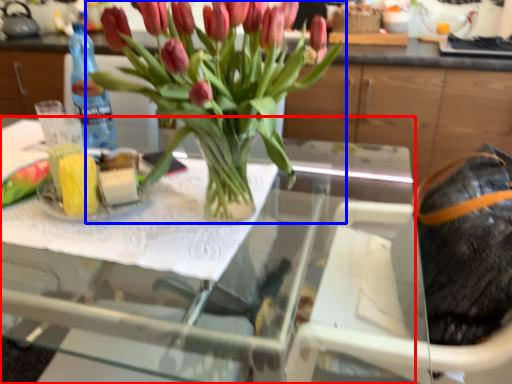
Question: Which point is closer to the camera, table (highlighted by a red box) or houseplant (highlighted by a blue box)?

Choices:
 (A) table
 (B) houseplant

Answer: (A)